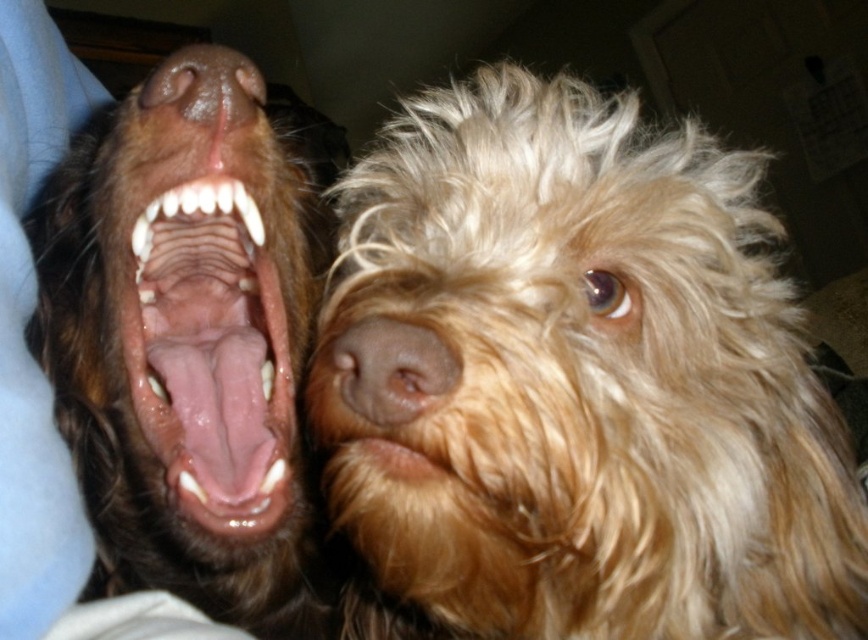
You are a photographer trying to focus on the pink flesh colored teeth at left. You want to ensure the teeth are in sharp focus. Given that the camera focuses on the point at point (211,355), will the teeth be in focus?

The pink flesh colored teeth at left are located at point (211,355), which is the focus point of the camera. Therefore, the teeth will be in sharp focus.

From the picture: You are a photographer trying to capture a closeup shot of the brown glossy teeth at upper left and the brown soft fur nose at center. Which object should you focus on first to ensure both are in focus?

The brown soft fur nose at center is behind brown glossy teeth at upper left, so you should focus on the brown glossy teeth at upper left first to ensure both are in focus.